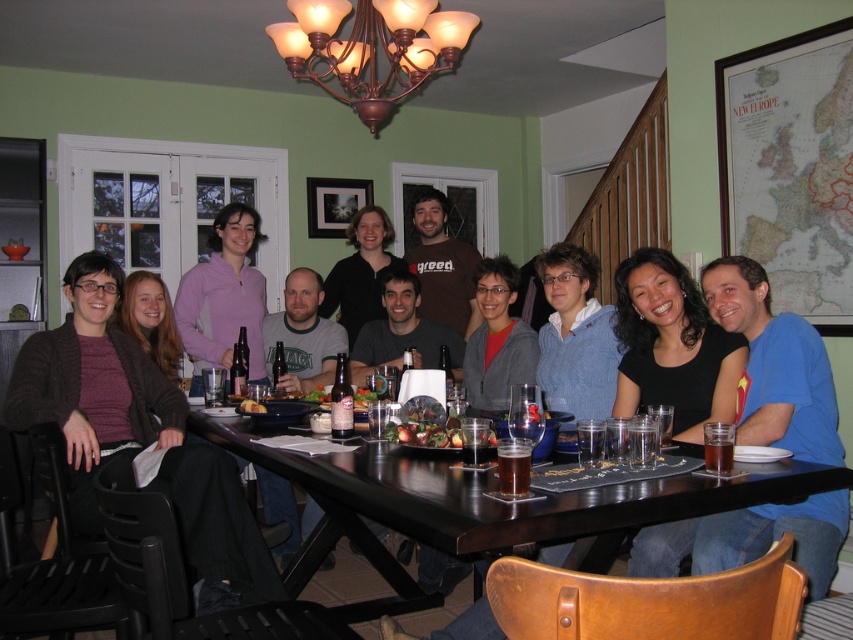
Does point (697, 502) lie behind point (531, 444)?

No, it is in front of (531, 444).

Does point (367, 545) lie in front of point (524, 438)?

No, it is not.

Locate an element on the screen. black wood table at center is located at coordinates (480, 504).

Who is lower down, brown glass beer at center or golden brown bread at table center?

brown glass beer at center is lower down.

Who is more forward, (518, 474) or (256, 403)?

Positioned in front is point (518, 474).

Who is more forward, (509,454) or (258,408)?

Point (509,454) is in front.

This screenshot has width=853, height=640. I want to click on brown glass beer at center, so click(x=514, y=465).

Consider the image. Does brown glass beer at center have a smaller size compared to translucent glass beer at table center?

Actually, brown glass beer at center might be larger than translucent glass beer at table center.

Is point (502, 456) positioned after point (722, 440)?

No, (502, 456) is closer to viewer.

The width and height of the screenshot is (853, 640). In order to click on brown glass beer at center in this screenshot , I will do `click(514, 465)`.